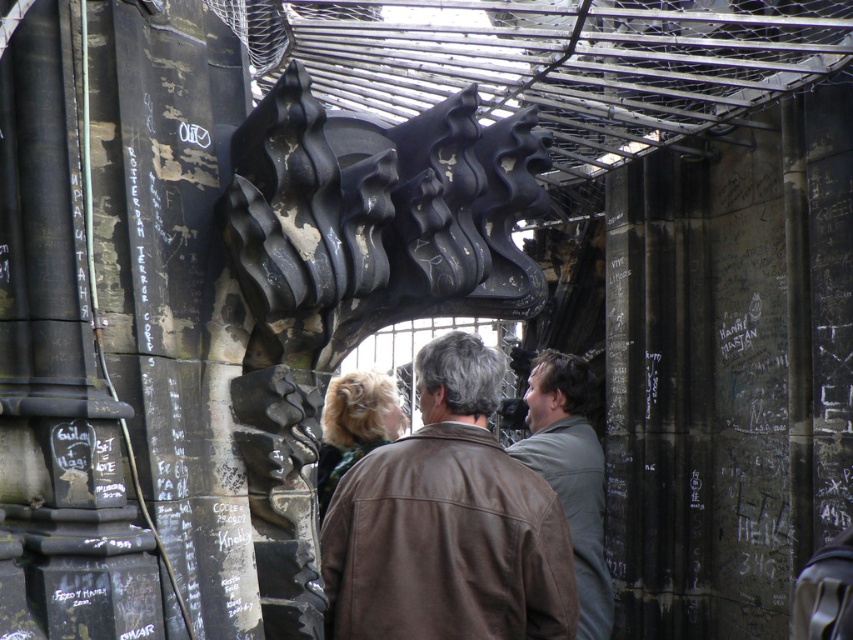
Question: Which of the following is the closest to the observer?

Choices:
 (A) (300, 148)
 (B) (445, 577)

Answer: (A)

Question: Does brown leather jacket at center come behind blonde hair at center?

Choices:
 (A) no
 (B) yes

Answer: (A)

Question: In this image, where is black matte sculpture at center located relative to blonde hair at center?

Choices:
 (A) above
 (B) below

Answer: (A)

Question: Which point is closer to the camera?

Choices:
 (A) (550, 449)
 (B) (328, 476)

Answer: (A)

Question: Is black matte sculpture at center below blonde hair at center?

Choices:
 (A) no
 (B) yes

Answer: (A)

Question: Which is nearer to the green matte jacket at center?

Choices:
 (A) brown leather jacket at center
 (B) black matte sculpture at center

Answer: (A)